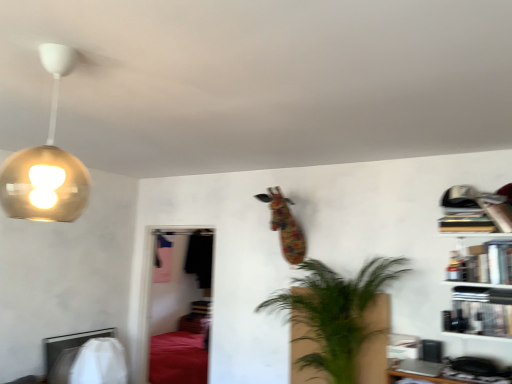
Question: Considering the relative positions of hardcover books at upper right, the third book ordered from the bottom, and hardcover book at upper right, positioned as the 2th book in bottom-to-top order, in the image provided, is hardcover books at upper right, the third book ordered from the bottom, to the left or to the right of hardcover book at upper right, positioned as the 2th book in bottom-to-top order,?

Choices:
 (A) right
 (B) left

Answer: (B)

Question: In the image, is hardcover books at upper right, which is the 1th book in top-to-bottom order, positioned in front of or behind hardcover book at upper right, marked as the 2th book in a top-to-bottom arrangement?

Choices:
 (A) front
 (B) behind

Answer: (B)

Question: Which object is the farthest from the gold metallic globe at upper left?

Choices:
 (A) hardcover book at upper right, marked as the 2th book in a top-to-bottom arrangement
 (B) green leafy plant at center
 (C) wooden bookshelf at right
 (D) hardcover books at upper right, which is the 1th book in top-to-bottom order
 (E) metallic silver book at right, placed as the 1th book when sorted from bottom to top

Answer: (E)

Question: Which object is the farthest from the wooden bookshelf at right?

Choices:
 (A) metallic silver book at right, placed as the 1th book when sorted from bottom to top
 (B) green leafy plant at center
 (C) hardcover books at upper right, the third book ordered from the bottom
 (D) hardcover book at upper right, positioned as the 2th book in bottom-to-top order
 (E) gold metallic globe at upper left

Answer: (E)